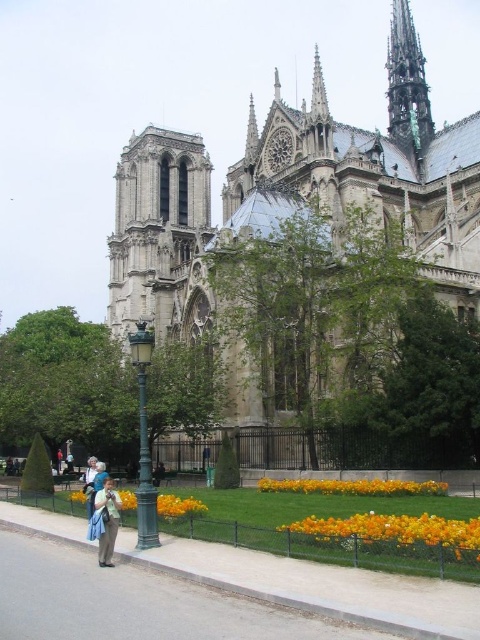
Between stone gothic cathedral at center and green metal lamp post at center-left, which one has less height?

green metal lamp post at center-left

Who is higher up, stone gothic cathedral at center or green metal lamp post at center-left?

stone gothic cathedral at center

Who is more forward, [477,284] or [151,529]?

Point [151,529] is more forward.

You are a GUI agent. You are given a task and a screenshot of the screen. Output one action in this format:
    pyautogui.click(x=<x>, y=<y>)
    Task: Click on the stone gothic cathedral at center
    This screenshot has height=640, width=480.
    Given the screenshot: What is the action you would take?
    pyautogui.click(x=283, y=204)

Can you confirm if light brown leather jacket at lower left is positioned to the left of yellow fabric flower at lower center?

Incorrect, light brown leather jacket at lower left is not on the left side of yellow fabric flower at lower center.

Which is more to the left, light brown leather jacket at lower left or yellow fabric flower at lower center?

From the viewer's perspective, yellow fabric flower at lower center appears more on the left side.

Looking at this image, who is more distant from viewer, (105, 504) or (127, 502)?

The point (127, 502) is behind.

Where is `light brown leather jacket at lower left`? The width and height of the screenshot is (480, 640). light brown leather jacket at lower left is located at coordinates (108, 520).

Is smooth concrete pavement at lower left wider than light brown leather jacket at lower left?

Indeed, smooth concrete pavement at lower left has a greater width compared to light brown leather jacket at lower left.

Can you confirm if smooth concrete pavement at lower left is positioned to the left of light brown leather jacket at lower left?

In fact, smooth concrete pavement at lower left is to the right of light brown leather jacket at lower left.

Between point (27, 524) and point (99, 540), which one is positioned behind?

Positioned behind is point (27, 524).

Locate an element on the screen. The image size is (480, 640). smooth concrete pavement at lower left is located at coordinates (320, 586).